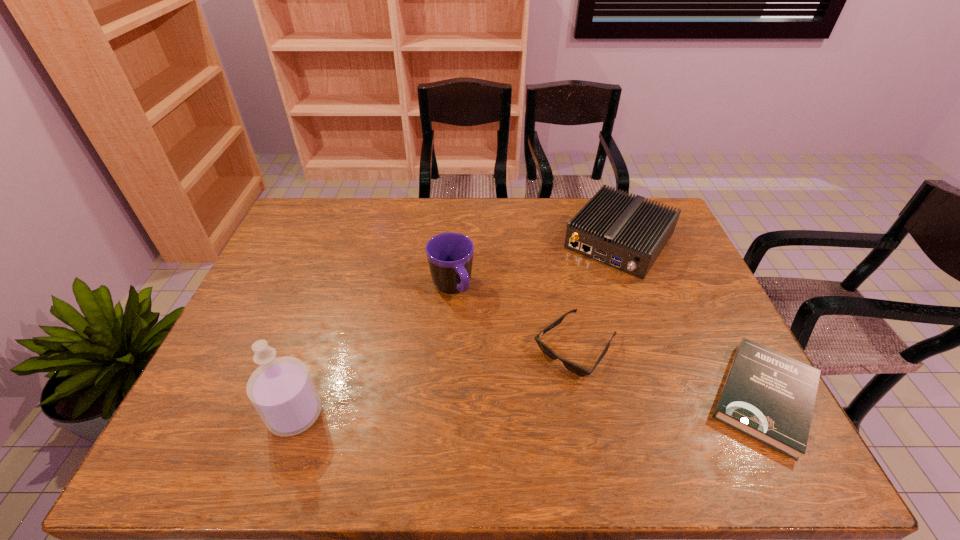
Find the location of a particular element. This screenshot has height=540, width=960. perfume is located at coordinates (281, 389).

This screenshot has height=540, width=960. In order to click on the leftmost object in this screenshot , I will do `click(281, 389)`.

The image size is (960, 540). Identify the location of the shortest object. (768, 396).

The image size is (960, 540). Identify the location of the second object from left to right. (450, 255).

What are the coordinates of `mug` in the screenshot? It's located at (450, 255).

The image size is (960, 540). What are the coordinates of `sunglasses` in the screenshot? It's located at (574, 368).

Find the location of a particular element. router is located at coordinates (623, 231).

Locate an element on the screen. The height and width of the screenshot is (540, 960). free location located 0.080m on the right of the leftmost object is located at coordinates (356, 414).

Where is `vacant space positioned on the left of the book`? Image resolution: width=960 pixels, height=540 pixels. vacant space positioned on the left of the book is located at coordinates (577, 397).

You are a GUI agent. You are given a task and a screenshot of the screen. Output one action in this format:
    pyautogui.click(x=<x>, y=<y>)
    Task: Click on the blank space located with the handle on the side of the mug
    This screenshot has width=960, height=540.
    Given the screenshot: What is the action you would take?
    pyautogui.click(x=524, y=420)